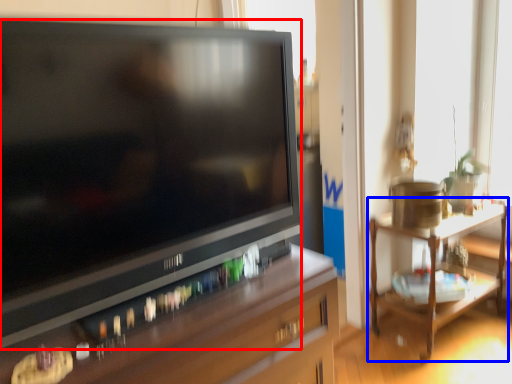
Question: Which object is closer to the camera taking this photo, television (highlighted by a red box) or table (highlighted by a blue box)?

Choices:
 (A) television
 (B) table

Answer: (A)